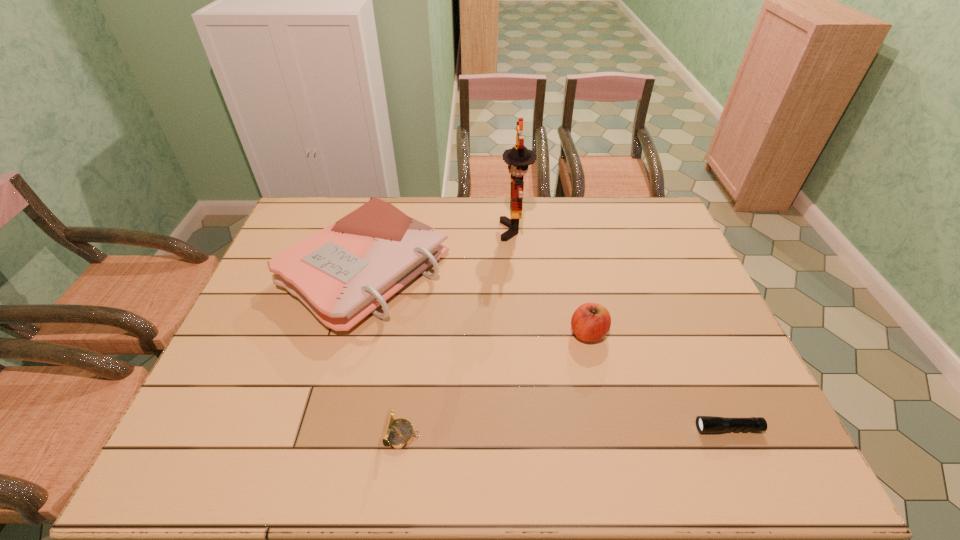
Where is `free spot located 0.130m on the front of the phonebook`? Image resolution: width=960 pixels, height=540 pixels. free spot located 0.130m on the front of the phonebook is located at coordinates (336, 378).

Where is `vacant space situated 0.170m on the right of the apple`? Image resolution: width=960 pixels, height=540 pixels. vacant space situated 0.170m on the right of the apple is located at coordinates (669, 333).

Locate an element on the screen. Image resolution: width=960 pixels, height=540 pixels. vacant position located 0.200m with the dial facing the compass is located at coordinates (507, 435).

In order to click on free location located 0.210m at the lens end of the rightmost object in this screenshot , I will do `click(606, 428)`.

The image size is (960, 540). I want to click on vacant space positioned at the lens end of the rightmost object, so click(x=549, y=428).

Where is `vacant space located 0.110m at the lens end of the rightmost object`? Image resolution: width=960 pixels, height=540 pixels. vacant space located 0.110m at the lens end of the rightmost object is located at coordinates (649, 428).

At what (x,y) coordinates should I click in order to perform the action: click on nutcracker present at the far edge. Please return your answer as a coordinate pair (x, y). The height and width of the screenshot is (540, 960). Looking at the image, I should click on (519, 157).

Where is `phonebook present at the far edge`? phonebook present at the far edge is located at coordinates (342, 273).

The image size is (960, 540). I want to click on object that is at the near edge, so click(398, 433).

In order to click on object located at the left edge in this screenshot , I will do `click(342, 273)`.